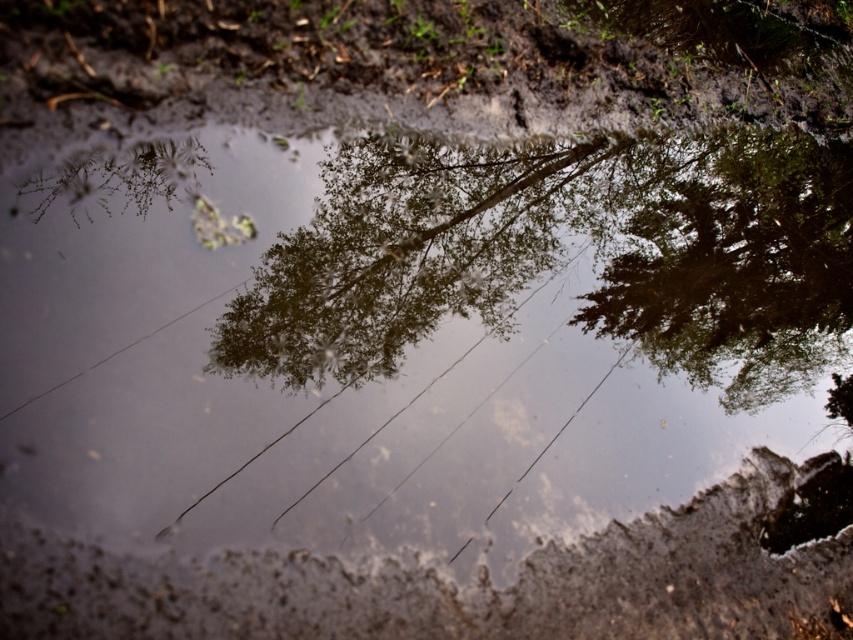
Question: Among these points, which one is farthest from the camera?

Choices:
 (A) pos(547,252)
 (B) pos(141,572)

Answer: (A)

Question: Does green leafy tree at center have a smaller size compared to muddy wet ground at bottom?

Choices:
 (A) no
 (B) yes

Answer: (A)

Question: Is muddy wet ground at bottom thinner than green leafy tree at upper right?

Choices:
 (A) yes
 (B) no

Answer: (B)

Question: Which point is farther to the camera?

Choices:
 (A) green leafy tree at center
 (B) muddy wet ground at bottom

Answer: (A)

Question: Is green leafy tree at center above muddy wet ground at bottom?

Choices:
 (A) no
 (B) yes

Answer: (B)

Question: Which point is farther to the camera?

Choices:
 (A) (606, 228)
 (B) (788, 280)
 (C) (727, 497)

Answer: (B)